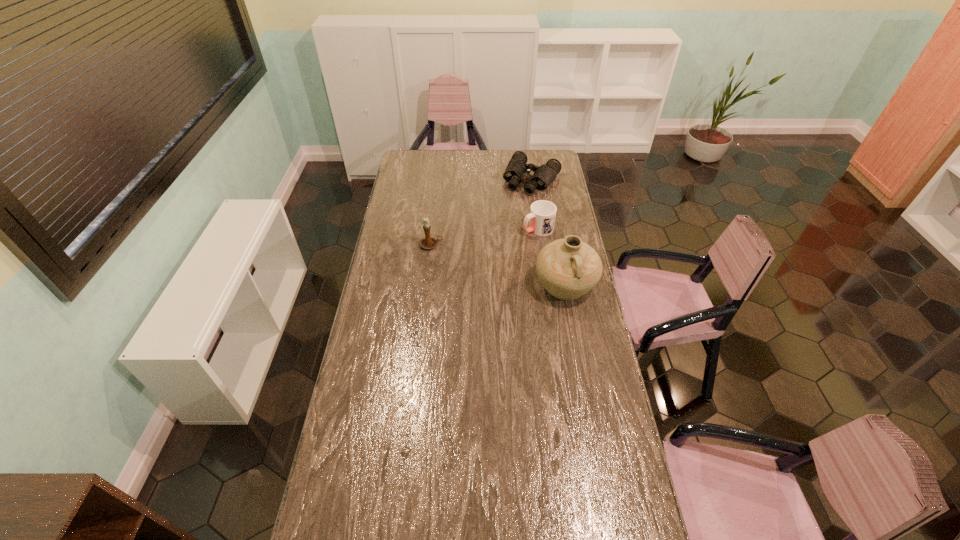
You are a GUI agent. You are given a task and a screenshot of the screen. Output one action in this format:
    pyautogui.click(x=<x>, y=<y>)
    Task: Click on the second nearest object
    
    Given the screenshot: What is the action you would take?
    pyautogui.click(x=428, y=242)

I want to click on the third shortest object, so click(x=428, y=242).

Image resolution: width=960 pixels, height=540 pixels. I want to click on pottery, so click(568, 268).

Identify the location of the nearest object. (568, 268).

Find the location of `the farthest object`. the farthest object is located at coordinates tap(517, 171).

I want to click on the shortest object, so click(517, 171).

Find the location of a particular element. This screenshot has width=960, height=540. the third nearest object is located at coordinates (542, 215).

Where is `mug`? This screenshot has width=960, height=540. mug is located at coordinates (542, 215).

Identify the location of free spot located on the side of the second nearest object with the handle. The height and width of the screenshot is (540, 960). (525, 245).

Identify the location of vacant space located on the back of the nearest object. The width and height of the screenshot is (960, 540). (559, 251).